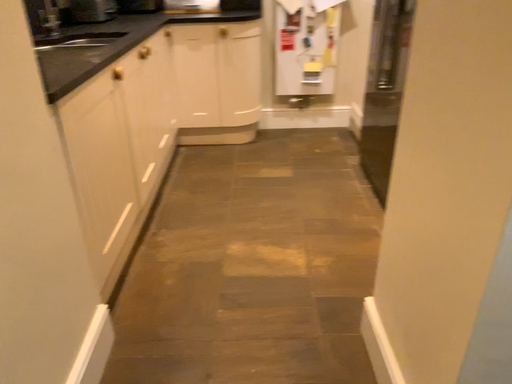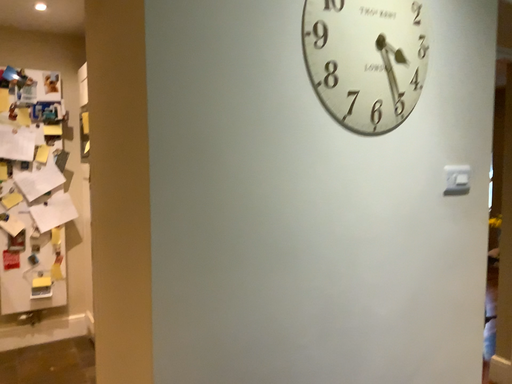
Question: Which way did the camera rotate in the video?

Choices:
 (A) rotated downward
 (B) rotated upward

Answer: (B)